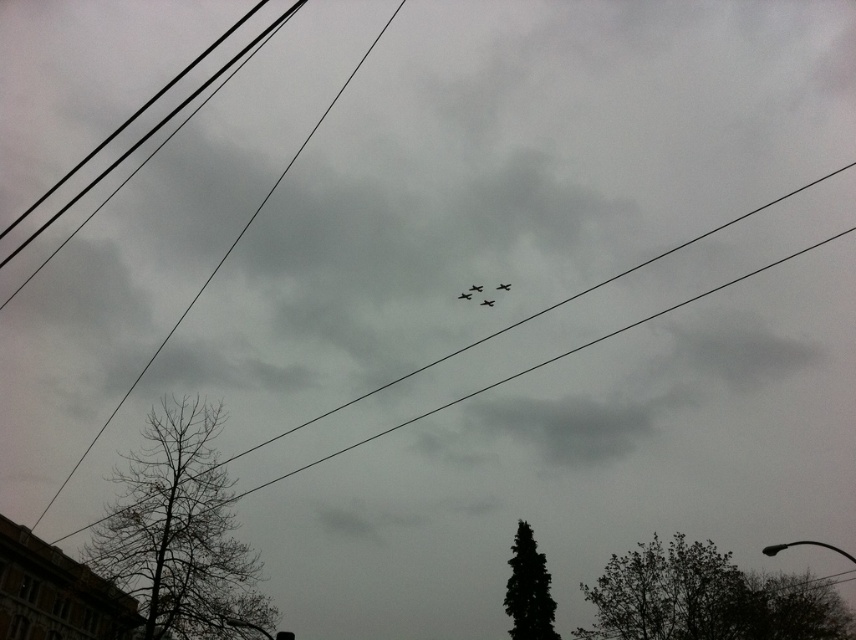
Is the position of black wire at upper center more distant than that of metallic gray airplane at center?

No.

Measure the distance between black wire at upper center and camera.

193.55 feet

Is point (82, 529) less distant than point (483, 301)?

Yes, it is.

Find the location of a particular element. Image resolution: width=856 pixels, height=640 pixels. black wire at upper center is located at coordinates point(539,310).

Based on the photo, does green leafy tree at lower right have a greater width compared to metallic gray airplane at center?

Yes.

Locate an element on the screen. green leafy tree at lower right is located at coordinates (528, 589).

Which is more to the right, green leafy tree at lower right or metallic silver plane at center?

From the viewer's perspective, green leafy tree at lower right appears more on the right side.

Does green leafy tree at lower right come behind metallic silver plane at center?

No, it is not.

Who is more distant from viewer, (x=533, y=570) or (x=502, y=288)?

Positioned behind is point (x=502, y=288).

Identify the location of green leafy tree at lower right. The image size is (856, 640). (528, 589).